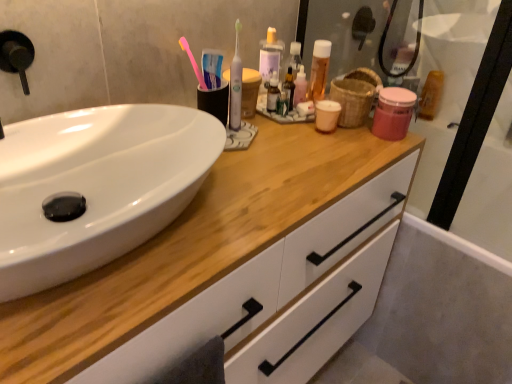
The height and width of the screenshot is (384, 512). Find the location of `vacant space in front of translucent plastic mouthwash at center, the 2th mouthwash from the back`. vacant space in front of translucent plastic mouthwash at center, the 2th mouthwash from the back is located at coordinates (324, 140).